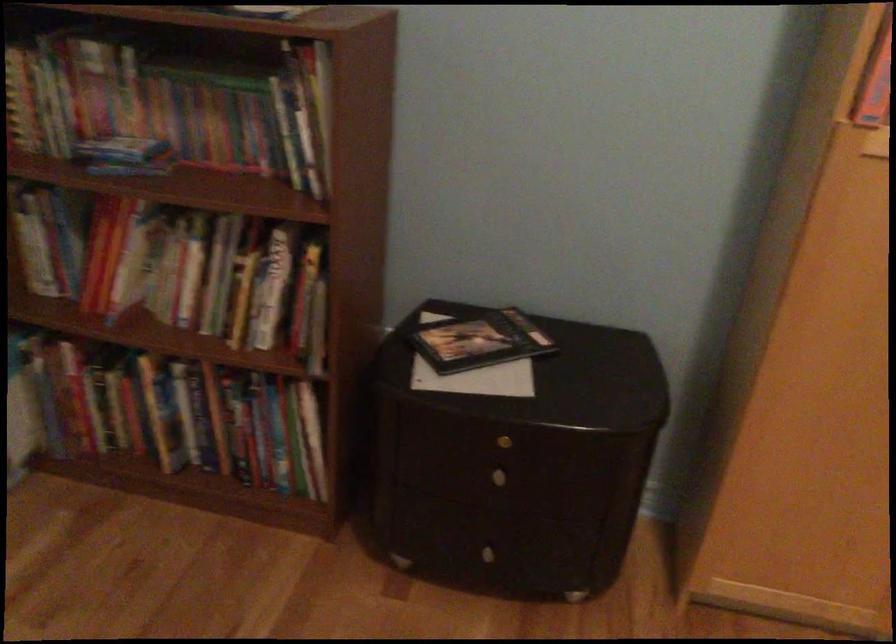
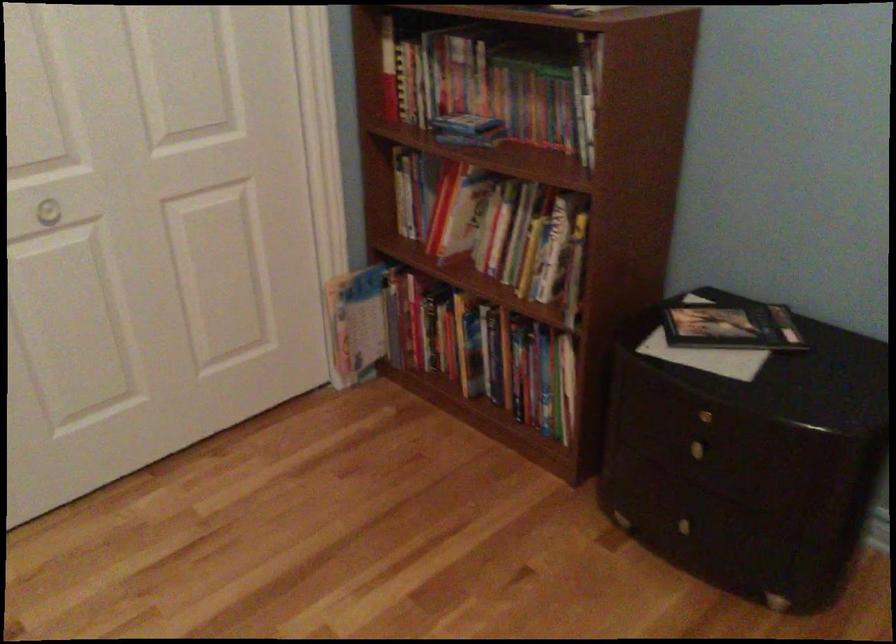
The point at (x=231, y=120) is marked in the first image. Where is the corresponding point in the second image?

(545, 102)